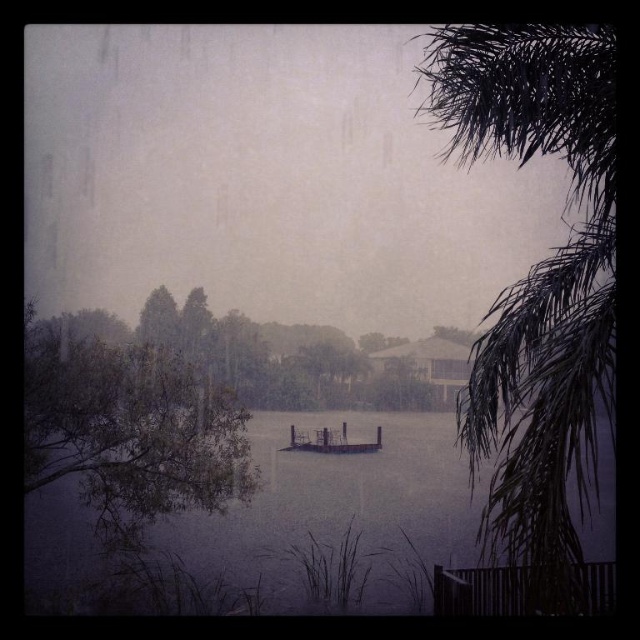
Can you confirm if dark green leafy palm tree at right is wider than green matte tree at left?

No.

Does point (557, 100) come farther from viewer compared to point (106, 461)?

No, it is not.

You are a GUI agent. You are given a task and a screenshot of the screen. Output one action in this format:
    pyautogui.click(x=<x>, y=<y>)
    Task: Click on the dark green leafy palm tree at right
    The width and height of the screenshot is (640, 640).
    Given the screenshot: What is the action you would take?
    pyautogui.click(x=538, y=291)

Who is positioned more to the left, dark green leafy palm tree at right or green leafy tree at center?

Positioned to the left is green leafy tree at center.

Who is shorter, dark green leafy palm tree at right or green leafy tree at center?

With less height is green leafy tree at center.

Describe the element at coordinates (538, 291) in the screenshot. The image size is (640, 640). I see `dark green leafy palm tree at right` at that location.

Find the location of a particular element. dark green leafy palm tree at right is located at coordinates (538, 291).

Does green leafy tree at center appear on the left side of wooden dock at center?

Yes, green leafy tree at center is to the left of wooden dock at center.

This screenshot has height=640, width=640. What do you see at coordinates (260, 356) in the screenshot?
I see `green leafy tree at center` at bounding box center [260, 356].

The image size is (640, 640). I want to click on green leafy tree at center, so click(260, 356).